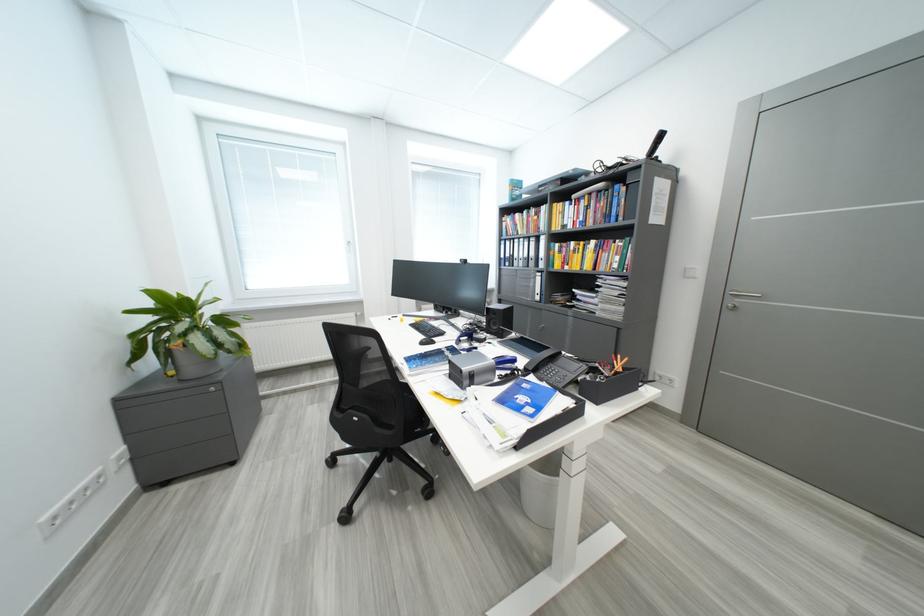
What do you see at coordinates (743, 294) in the screenshot? I see `the black cabinet handle` at bounding box center [743, 294].